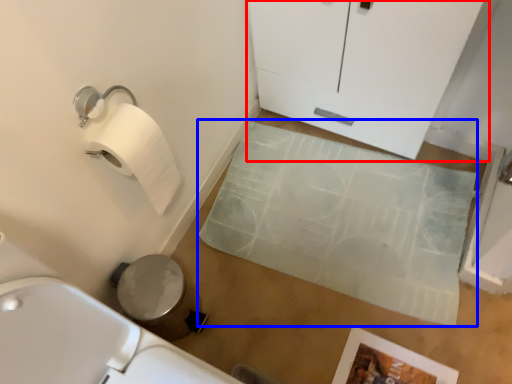
Question: Which object is further to the camera taking this photo, glass door (highlighted by a red box) or bath mat (highlighted by a blue box)?

Choices:
 (A) glass door
 (B) bath mat

Answer: (B)